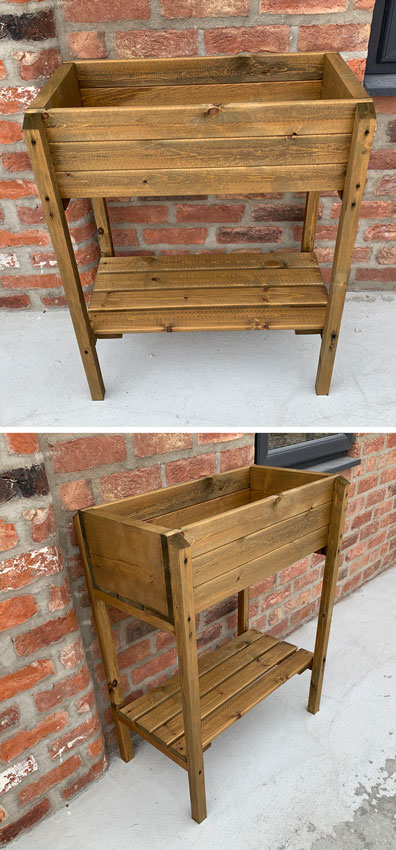
The width and height of the screenshot is (396, 850). What are the coordinates of `window ledge` in the screenshot? It's located at (379, 76).